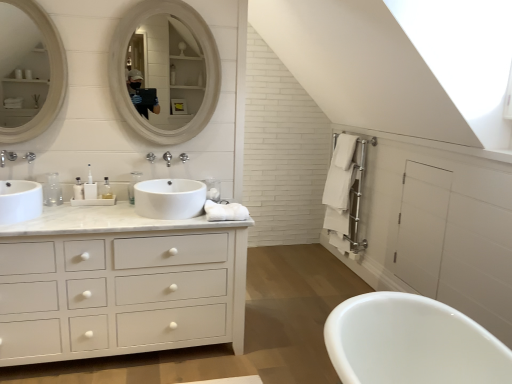
Question: Is clear plastic bottle at center, which ranks as the 2th toiletry in right-to-left order, looking in the opposite direction of white glossy sink at left, the first sink from the left?

Choices:
 (A) yes
 (B) no

Answer: (B)

Question: Considering the relative sizes of clear plastic bottle at center, which is counted as the 1th toiletry, starting from the left, and white glossy sink at left, positioned as the second sink in right-to-left order, in the image provided, is clear plastic bottle at center, which is counted as the 1th toiletry, starting from the left, shorter than white glossy sink at left, positioned as the second sink in right-to-left order,?

Choices:
 (A) yes
 (B) no

Answer: (B)

Question: Considering the relative positions of clear plastic bottle at center, which is counted as the 1th toiletry, starting from the left, and white glossy sink at left, the first sink from the left, in the image provided, is clear plastic bottle at center, which is counted as the 1th toiletry, starting from the left, to the right of white glossy sink at left, the first sink from the left, from the viewer's perspective?

Choices:
 (A) yes
 (B) no

Answer: (A)

Question: Is white glossy sink at left, positioned as the second sink in right-to-left order, completely or partially inside clear plastic bottle at center, which is counted as the 1th toiletry, starting from the left?

Choices:
 (A) yes
 (B) no

Answer: (B)

Question: Considering the relative sizes of clear plastic bottle at center, which is counted as the 1th toiletry, starting from the left, and white glossy sink at left, positioned as the second sink in right-to-left order, in the image provided, is clear plastic bottle at center, which is counted as the 1th toiletry, starting from the left, wider than white glossy sink at left, positioned as the second sink in right-to-left order,?

Choices:
 (A) yes
 (B) no

Answer: (B)

Question: Considering the relative positions of clear plastic bottle at center, which is counted as the 1th toiletry, starting from the left, and brushed metal faucet at upper center, marked as the first faucet in a right-to-left arrangement, in the image provided, is clear plastic bottle at center, which is counted as the 1th toiletry, starting from the left, to the left or to the right of brushed metal faucet at upper center, marked as the first faucet in a right-to-left arrangement,?

Choices:
 (A) left
 (B) right

Answer: (A)

Question: From a real-world perspective, is clear plastic bottle at center, which ranks as the 2th toiletry in right-to-left order, above or below brushed metal faucet at upper center, acting as the second faucet starting from the front?

Choices:
 (A) above
 (B) below

Answer: (B)

Question: From their relative heights in the image, would you say clear plastic bottle at center, which is counted as the 1th toiletry, starting from the left, is taller or shorter than brushed metal faucet at upper center, the 2th faucet from the left?

Choices:
 (A) tall
 (B) short

Answer: (A)

Question: In terms of width, does clear plastic bottle at center, which is counted as the 1th toiletry, starting from the left, look wider or thinner when compared to brushed metal faucet at upper center, the first faucet positioned from the back?

Choices:
 (A) wide
 (B) thin

Answer: (A)

Question: Is point (10, 150) closer or farther from the camera than point (138, 196)?

Choices:
 (A) closer
 (B) farther

Answer: (B)

Question: Considering the positions of brushed metal faucet at left and white glossy sink at center, arranged as the second sink when viewed from the left, in the image, is brushed metal faucet at left wider or thinner than white glossy sink at center, arranged as the second sink when viewed from the left,?

Choices:
 (A) wide
 (B) thin

Answer: (B)

Question: Would you say brushed metal faucet at left is inside or outside white glossy sink at center, positioned as the 1th sink in right-to-left order?

Choices:
 (A) outside
 (B) inside

Answer: (A)

Question: Would you say brushed metal faucet at left is to the left or to the right of white glossy sink at center, positioned as the 1th sink in right-to-left order, in the picture?

Choices:
 (A) right
 (B) left

Answer: (B)

Question: From the image's perspective, is white plastic soap dispenser at center above or below white glossy sink at center, arranged as the second sink when viewed from the left?

Choices:
 (A) below
 (B) above

Answer: (B)

Question: In terms of width, does white plastic soap dispenser at center look wider or thinner when compared to white glossy sink at center, positioned as the 1th sink in right-to-left order?

Choices:
 (A) thin
 (B) wide

Answer: (A)